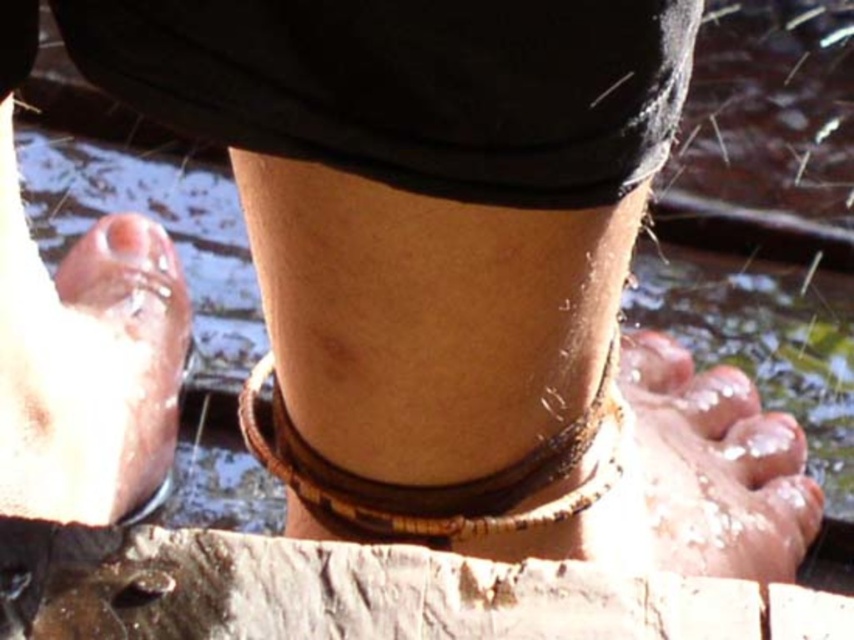
Between pink matte toe at lower right and glistening skin toe at lower center, which one is positioned higher?

glistening skin toe at lower center is higher up.

Is pink matte toe at lower right below glistening skin toe at lower center?

Yes.

Is point (752, 464) positioned behind point (712, 408)?

No, it is in front of (712, 408).

Locate an element on the screen. pink matte toe at lower right is located at coordinates (762, 448).

Is the position of brown rough wood at lower center more distant than that of pink matte toe at lower right?

No, it is not.

Can you confirm if brown rough wood at lower center is smaller than pink matte toe at lower right?

Actually, brown rough wood at lower center might be larger than pink matte toe at lower right.

This screenshot has width=854, height=640. Describe the element at coordinates (361, 593) in the screenshot. I see `brown rough wood at lower center` at that location.

This screenshot has width=854, height=640. Find the location of `brown rough wood at lower center`. brown rough wood at lower center is located at coordinates (361, 593).

Can you confirm if pink smooth skin at lower left is wider than pink matte toe at lower right?

Correct, the width of pink smooth skin at lower left exceeds that of pink matte toe at lower right.

How far apart are pink smooth skin at lower left and pink matte toe at lower right?

66.08 centimeters

What are the coordinates of `pink smooth skin at lower left` in the screenshot? It's located at (94, 378).